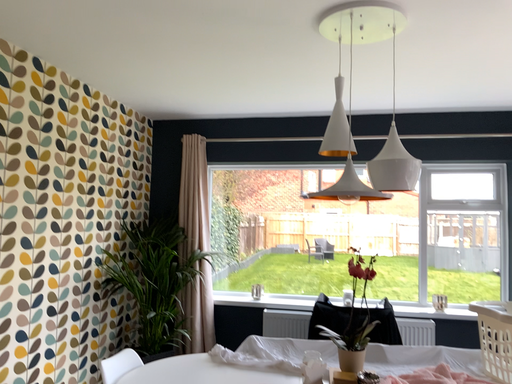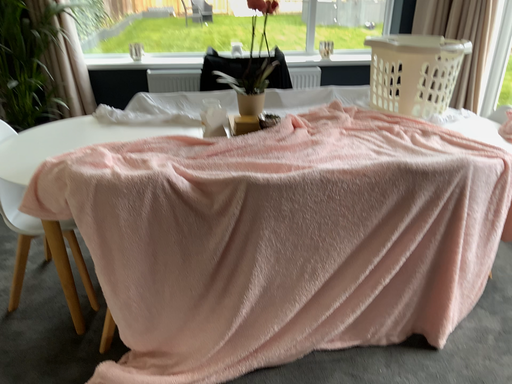
Question: How did the camera likely rotate when shooting the video?

Choices:
 (A) rotated downward
 (B) rotated upward

Answer: (A)